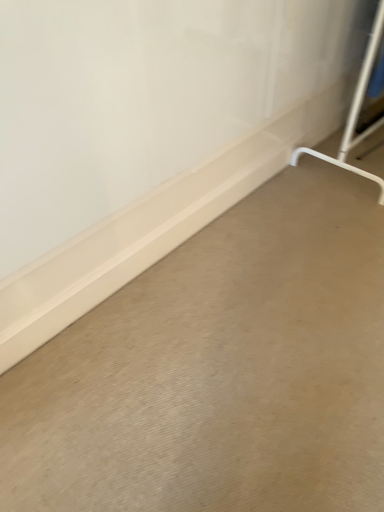
Find the location of `beige carpet at lower center`. beige carpet at lower center is located at coordinates (219, 370).

Describe the element at coordinates (219, 370) in the screenshot. The width and height of the screenshot is (384, 512). I see `beige carpet at lower center` at that location.

The height and width of the screenshot is (512, 384). Find the location of `beige carpet at lower center`. beige carpet at lower center is located at coordinates (219, 370).